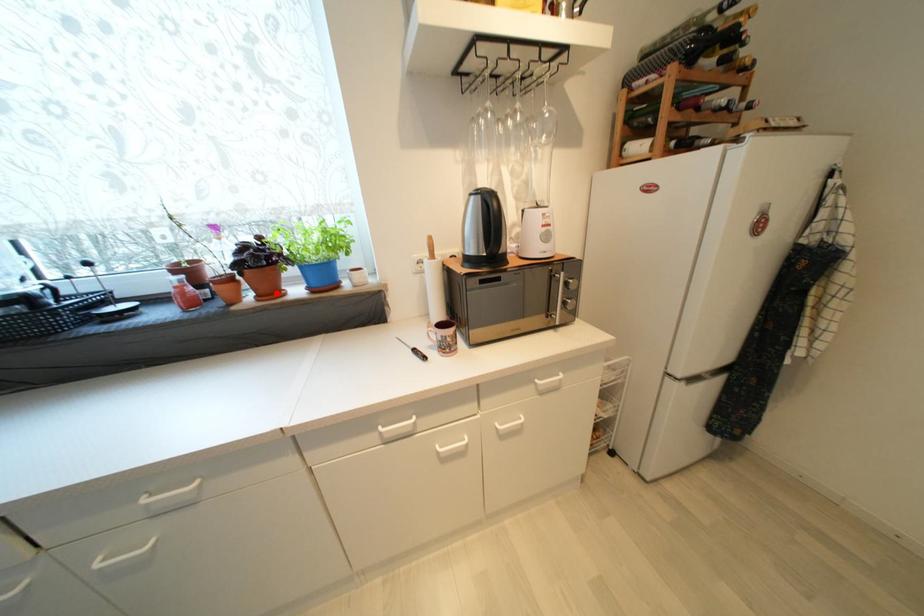
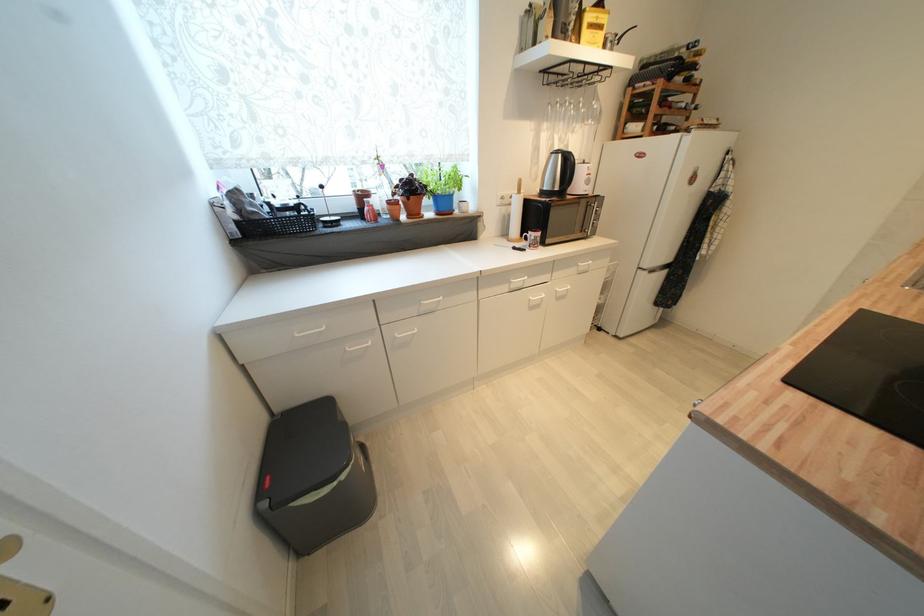
The point at the highlighted location is marked in the first image. Where is the corresponding point in the second image?

(419, 216)